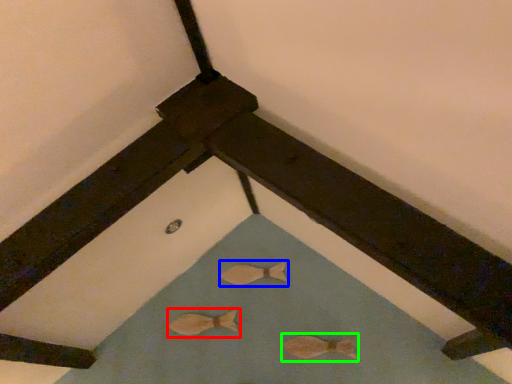
Question: Which object is the farthest from animal (highlighted by a red box)? Choose among these: animal (highlighted by a blue box) or animal (highlighted by a green box).

Choices:
 (A) animal
 (B) animal

Answer: (B)